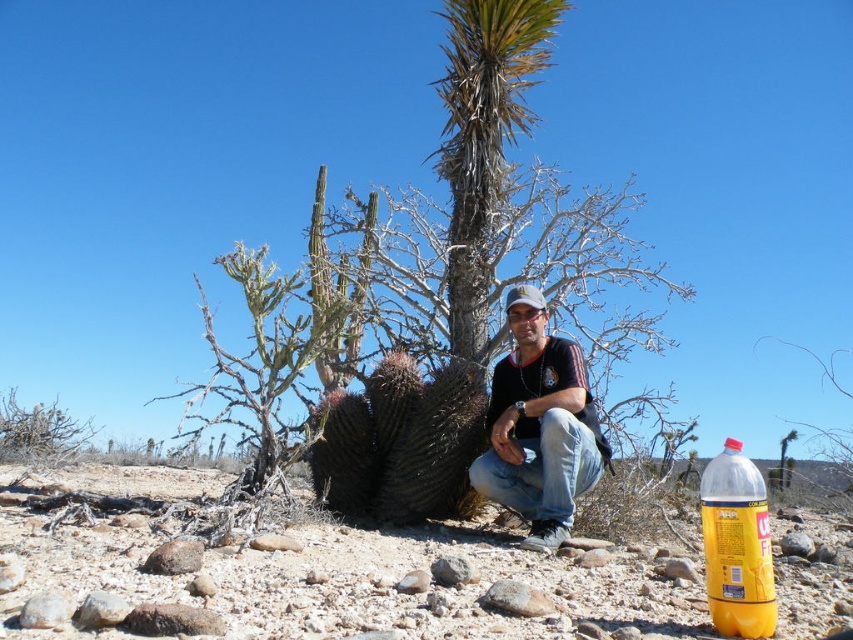
You are a hiker in the desert and need to determine which object is wider between the brown textured cactus at center and the yellow translucent bottle at lower right. Based on the scene, which one is wider?

The brown textured cactus at center is wider than the yellow translucent bottle at lower right.

You are a hiker in the desert and need to determine which object is wider. You see a green leafy palm tree at center and a yellow translucent bottle at lower right. Which one is wider?

The green leafy palm tree at center is wider than the yellow translucent bottle at lower right.